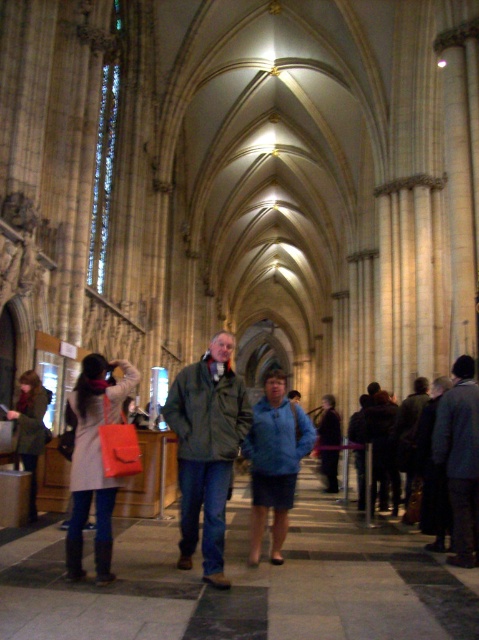
From the picture: You are standing in the cathedral and see both the dark gray wool coat at center and the dark blue fabric jacket at center. Which one is shorter in height?

The dark gray wool coat at center is not as tall as the dark blue fabric jacket at center, so the dark gray wool coat at center is shorter in height.

You are standing at the entrance of the cathedral and see both the green matte jacket at center and the matte brown coat at lower left. Which one is nearer to you?

The green matte jacket at center is closer to the viewer than the matte brown coat at lower left.